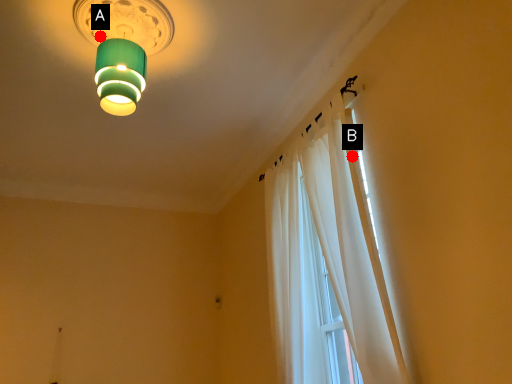
Question: Two points are circled on the image, labeled by A and B beside each circle. Which point is farther from the camera taking this photo?

Choices:
 (A) A is further
 (B) B is further

Answer: (A)